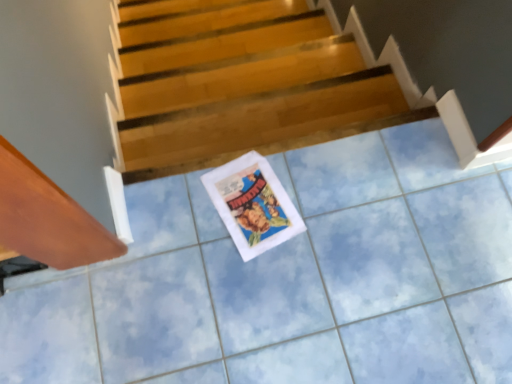
Identify the location of vacant area in front of white paper comic book at center. The image size is (512, 384). (243, 283).